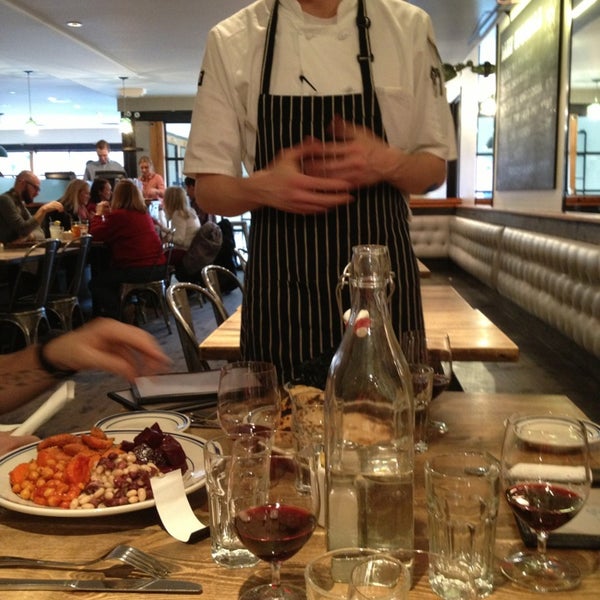
At what (x,y) coordinates should I click in order to perform the action: click on glass of wine. Please return your answer as a coordinate pair (x, y). The image size is (600, 600). Looking at the image, I should click on (241, 407), (265, 508), (533, 493), (444, 379).